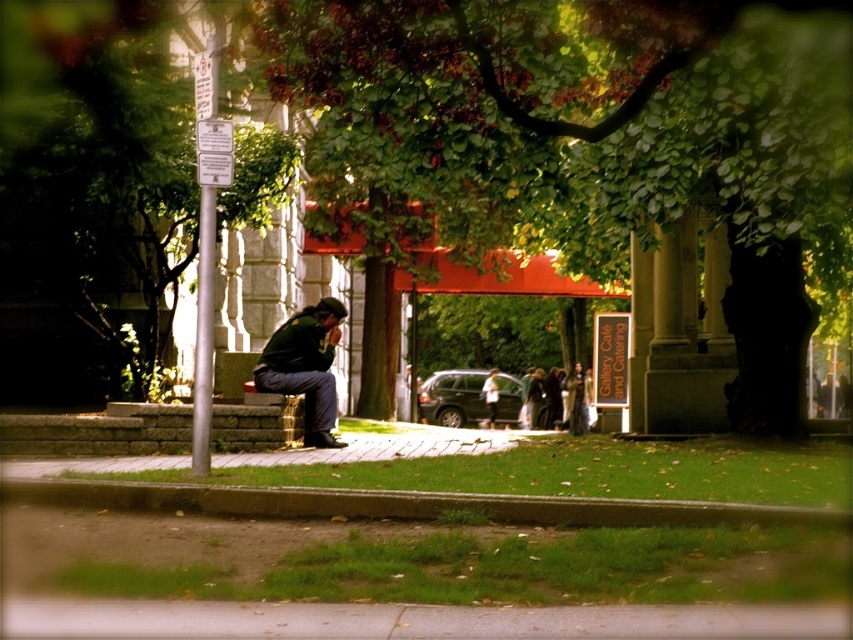
From the picture: Does green leafy tree at left lie in front of green fabric jacket at center?

Yes, green leafy tree at left is in front of green fabric jacket at center.

Does green leafy tree at left appear over green fabric jacket at center?

Yes.

Is point (65, 6) more distant than point (318, 320)?

That is False.

The image size is (853, 640). I want to click on green leafy tree at left, so click(x=93, y=182).

Is green leafy tree at left wider than gray concrete pavement at lower center?

No.

Between point (76, 99) and point (502, 611), which one is positioned behind?

The point (76, 99) is more distant.

Does point (161, 339) lie behind point (717, 634)?

That is True.

What are the coordinates of `green leafy tree at left` in the screenshot? It's located at (93, 182).

Is gray concrete pavement at lower center further to the viewer compared to white cotton shirt at center?

No, gray concrete pavement at lower center is closer to the viewer.

Is gray concrete pavement at lower center thinner than white cotton shirt at center?

In fact, gray concrete pavement at lower center might be wider than white cotton shirt at center.

Describe the element at coordinates (410, 620) in the screenshot. The width and height of the screenshot is (853, 640). I see `gray concrete pavement at lower center` at that location.

I want to click on gray concrete pavement at lower center, so click(x=410, y=620).